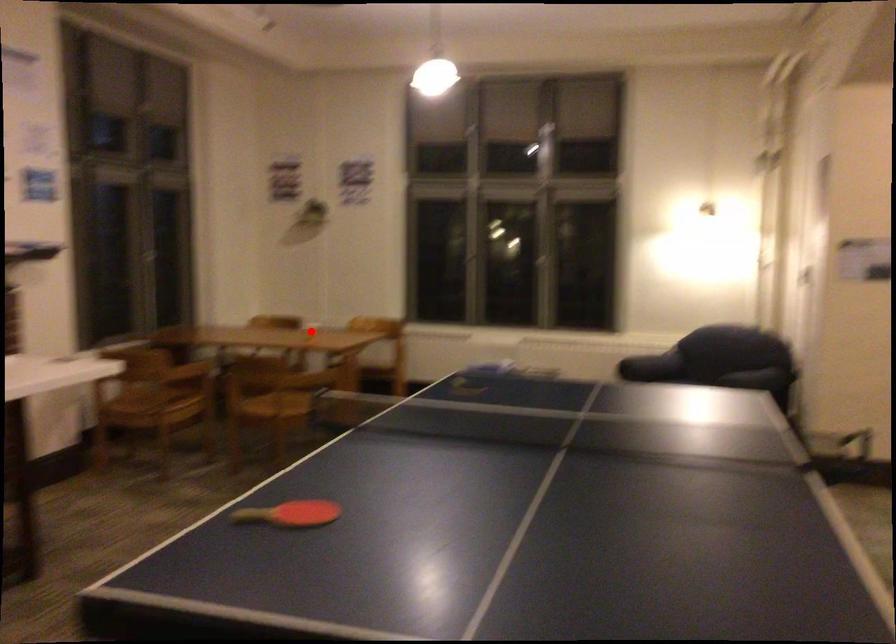
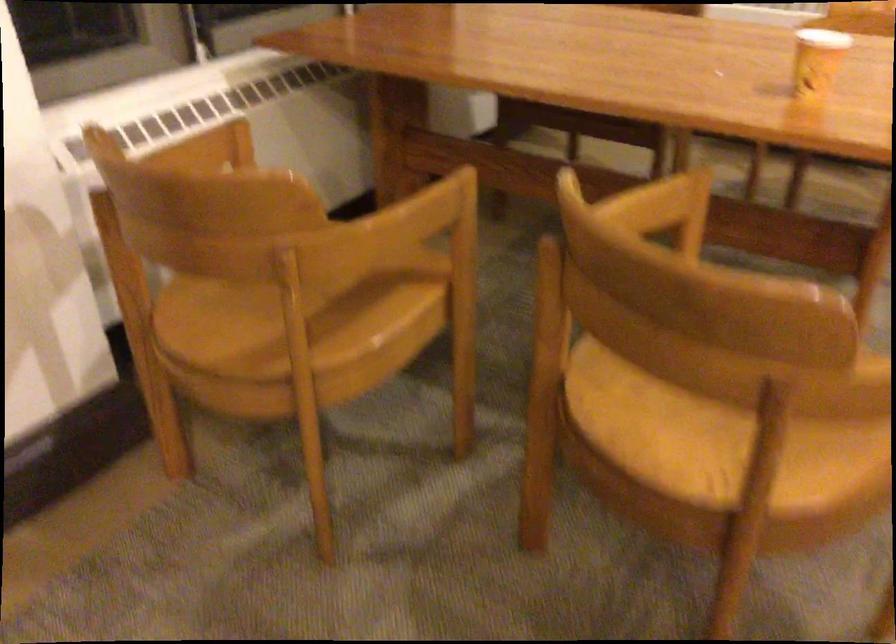
Question: I am providing you with two images of the same scene from different viewpoints. In image1, a red point is highlighted. Considering the same 3D point in image2, which of the following is correct?

Choices:
 (A) It is closer
 (B) It is farther

Answer: (A)